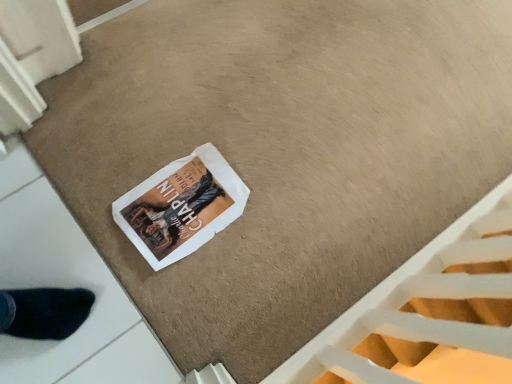
At what (x,y) coordinates should I click in order to perform the action: click on blank space to the left of white paper magazine at center. Please return your answer as a coordinate pair (x, y). The image size is (512, 384). Looking at the image, I should click on (119, 148).